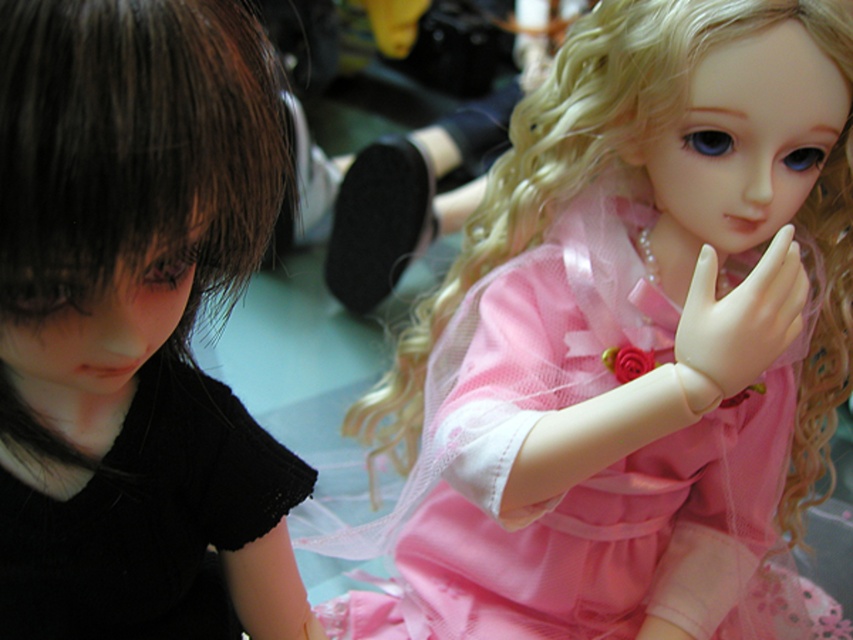
Can you confirm if matte pink fabric doll at center is positioned above black lace dress at left?

Indeed, matte pink fabric doll at center is positioned over black lace dress at left.

This screenshot has height=640, width=853. Identify the location of matte pink fabric doll at center. (631, 340).

Does black lace dress at left have a greater width compared to white matte hand at center?

Indeed, black lace dress at left has a greater width compared to white matte hand at center.

Which is more to the right, black lace dress at left or white matte hand at center?

white matte hand at center

Image resolution: width=853 pixels, height=640 pixels. Describe the element at coordinates (148, 520) in the screenshot. I see `black lace dress at left` at that location.

Image resolution: width=853 pixels, height=640 pixels. I want to click on black lace dress at left, so click(148, 520).

Who is more distant from viewer, (576, 45) or (57, 403)?

The point (576, 45) is behind.

Is matte pink fabric doll at center further to camera compared to matte black doll at left?

Yes, matte pink fabric doll at center is behind matte black doll at left.

The image size is (853, 640). What do you see at coordinates (631, 340) in the screenshot? I see `matte pink fabric doll at center` at bounding box center [631, 340].

I want to click on matte pink fabric doll at center, so click(x=631, y=340).